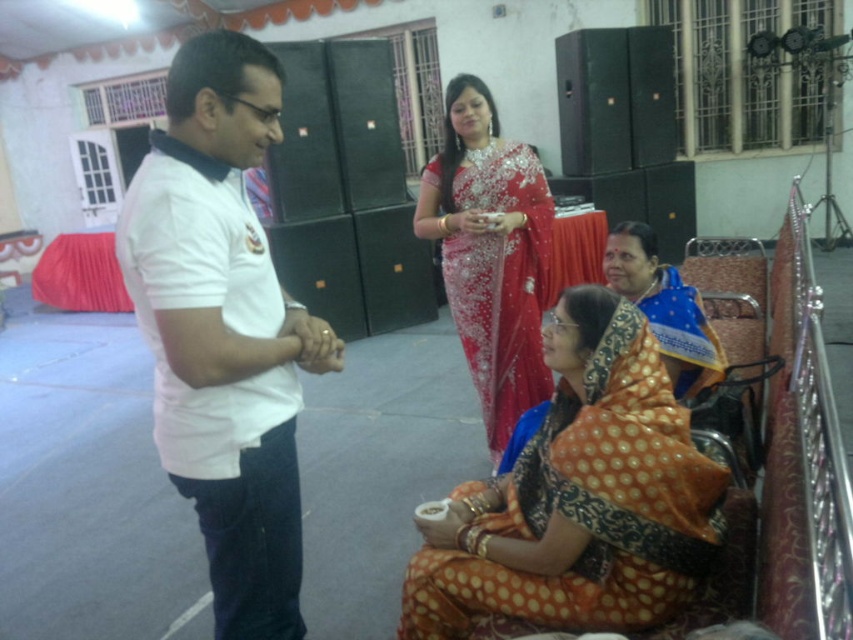
Is orange printed saree at center shorter than orange dotted saree at lower right?

In fact, orange printed saree at center may be taller than orange dotted saree at lower right.

Between point (607, 497) and point (683, 365), which one is positioned in front?

Positioned in front is point (607, 497).

Does point (573, 328) come in front of point (712, 369)?

Yes, it is.

This screenshot has width=853, height=640. Find the location of `orange printed saree at center`. orange printed saree at center is located at coordinates (579, 497).

Which is more to the right, white cotton shirt at left or shiny red saree at center?

From the viewer's perspective, shiny red saree at center appears more on the right side.

Is white cotton shirt at left bigger than shiny red saree at center?

Actually, white cotton shirt at left might be smaller than shiny red saree at center.

Is point (161, 211) positioned after point (514, 308)?

No, it is in front of (514, 308).

Identify the location of white cotton shirt at left. (223, 330).

Does shiny red saree at center appear on the left side of orange dotted saree at lower right?

Indeed, shiny red saree at center is positioned on the left side of orange dotted saree at lower right.

Is shiny red saree at center bigger than orange dotted saree at lower right?

Yes, shiny red saree at center is bigger than orange dotted saree at lower right.

Is point (466, 132) farther from viewer compared to point (650, 288)?

Yes, point (466, 132) is farther from viewer.

Where is `shiny red saree at center`? shiny red saree at center is located at coordinates (490, 252).